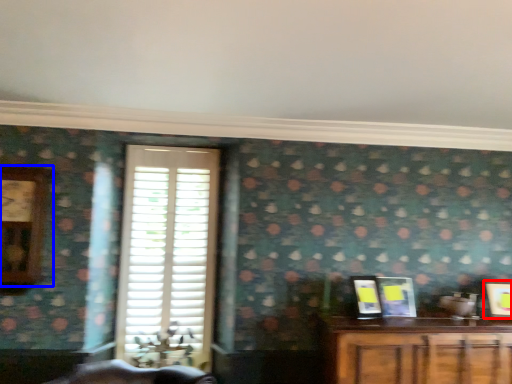
Question: Which of the following is the farthest to the observer, picture frame (highlighted by a red box) or clock (highlighted by a blue box)?

Choices:
 (A) picture frame
 (B) clock

Answer: (A)